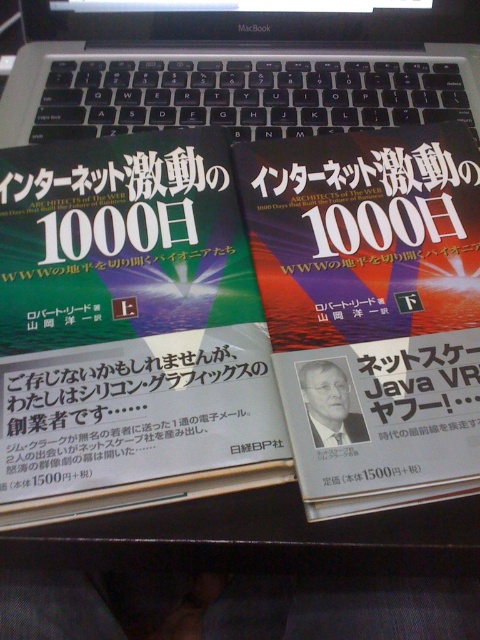
Which is above, matte paper book at center or black plastic keyboard at upper center?

black plastic keyboard at upper center is higher up.

Is point (420, 465) closer to camera compared to point (229, 88)?

Yes, point (420, 465) is in front of point (229, 88).

The image size is (480, 640). What do you see at coordinates (372, 308) in the screenshot?
I see `matte paper book at center` at bounding box center [372, 308].

Where is `matte paper book at center`? The height and width of the screenshot is (640, 480). matte paper book at center is located at coordinates (372, 308).

Does matte hardcover book at center lie in front of matte paper book at center?

That is True.

Does matte hardcover book at center have a greater width compared to matte paper book at center?

Correct, the width of matte hardcover book at center exceeds that of matte paper book at center.

This screenshot has width=480, height=640. Describe the element at coordinates (129, 330) in the screenshot. I see `matte hardcover book at center` at that location.

The image size is (480, 640). What are the coordinates of `matte hardcover book at center` in the screenshot? It's located at (129, 330).

Is matte hardcover book at center positioned behind black plastic keyboard at upper center?

No, matte hardcover book at center is in front of black plastic keyboard at upper center.

Who is more distant from viewer, (204,326) or (453,93)?

Point (453,93)

Describe the element at coordinates (129, 330) in the screenshot. This screenshot has width=480, height=640. I see `matte hardcover book at center` at that location.

Where is `matte hardcover book at center`? The width and height of the screenshot is (480, 640). matte hardcover book at center is located at coordinates (129, 330).